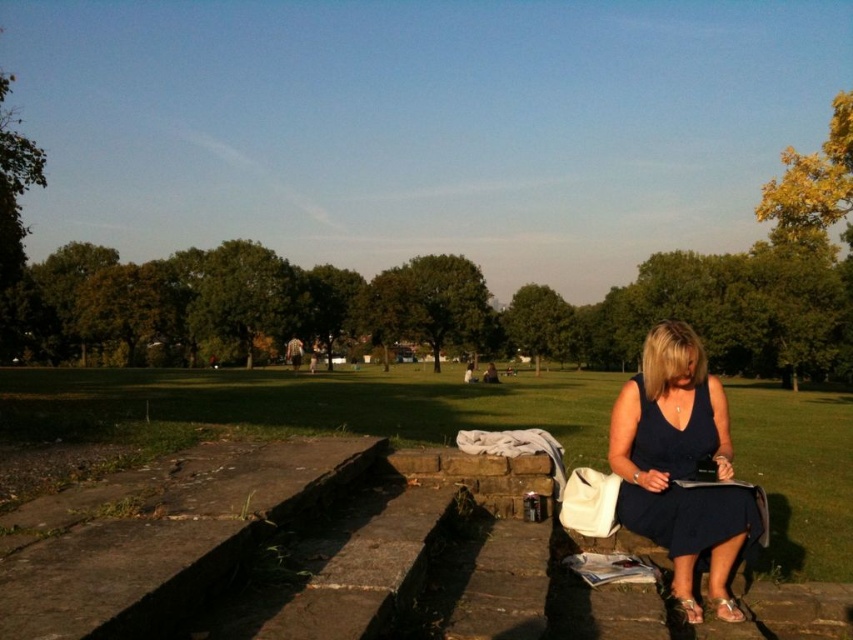
Question: Is metallic gold sandal at lower right bigger than suede-like beige sandal at lower right?

Choices:
 (A) no
 (B) yes

Answer: (B)

Question: Does metallic gold sandal at lower right come in front of suede-like beige sandal at lower right?

Choices:
 (A) yes
 (B) no

Answer: (A)

Question: Among these points, which one is nearest to the camera?

Choices:
 (A) click(x=683, y=605)
 (B) click(x=714, y=604)
 (C) click(x=695, y=490)

Answer: (C)

Question: Which is farther from the metallic gold sandal at lower right?

Choices:
 (A) suede-like beige sandal at lower right
 (B) navy blue dress at lower right

Answer: (B)

Question: Which point is closer to the camera?

Choices:
 (A) (724, 568)
 (B) (721, 618)
 (C) (693, 609)

Answer: (B)

Question: Does navy blue dress at lower right appear on the right side of metallic gold sandal at lower right?

Choices:
 (A) no
 (B) yes

Answer: (A)